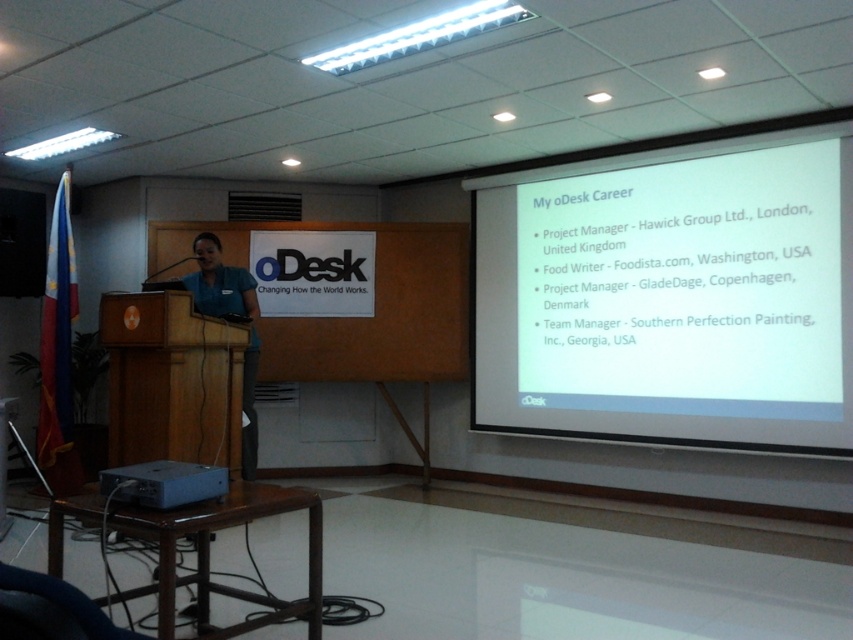
Between white matte projector screen at upper right and gray metallic projector at lower left, which one has less height?

With less height is gray metallic projector at lower left.

Between white matte projector screen at upper right and gray metallic projector at lower left, which one is positioned higher?

Positioned higher is white matte projector screen at upper right.

Between point (512, 317) and point (195, 465), which one is positioned in front?

Point (195, 465) is in front.

At what (x,y) coordinates should I click in order to perform the action: click on white matte projector screen at upper right. Please return your answer as a coordinate pair (x, y). Looking at the image, I should click on (670, 296).